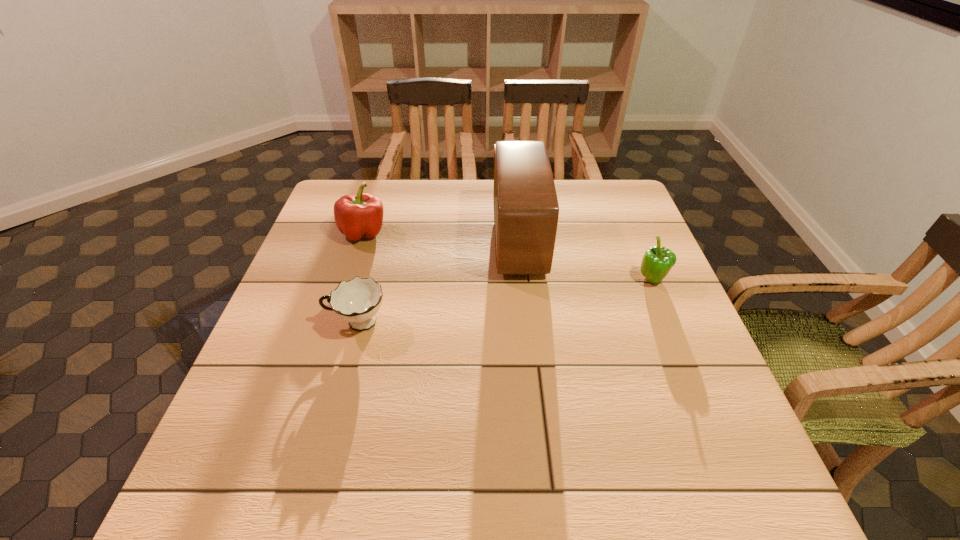
The height and width of the screenshot is (540, 960). In order to click on free space located on the right of the left bell pepper in this screenshot , I will do `click(466, 232)`.

This screenshot has height=540, width=960. In order to click on vacant space located 0.370m on the back of the right bell pepper in this screenshot , I will do `click(615, 191)`.

Locate an element on the screen. The image size is (960, 540). free spot located on the side of the cup with the handle is located at coordinates (285, 323).

At what (x,y) coordinates should I click in order to perform the action: click on radio receiver present at the far edge. Please return your answer as a coordinate pair (x, y). Looking at the image, I should click on (526, 210).

This screenshot has height=540, width=960. Identify the location of bell pepper located in the far edge section of the desktop. (359, 216).

Locate an element on the screen. Image resolution: width=960 pixels, height=540 pixels. bell pepper at the left edge is located at coordinates click(359, 216).

What are the coordinates of `cup present at the left edge` in the screenshot? It's located at click(x=357, y=301).

Locate an element on the screen. The width and height of the screenshot is (960, 540). object that is at the right edge is located at coordinates (657, 261).

Locate an element on the screen. Image resolution: width=960 pixels, height=540 pixels. object located in the far left corner section of the desktop is located at coordinates (359, 216).

Locate an element on the screen. Image resolution: width=960 pixels, height=540 pixels. blank space at the far edge is located at coordinates (570, 219).